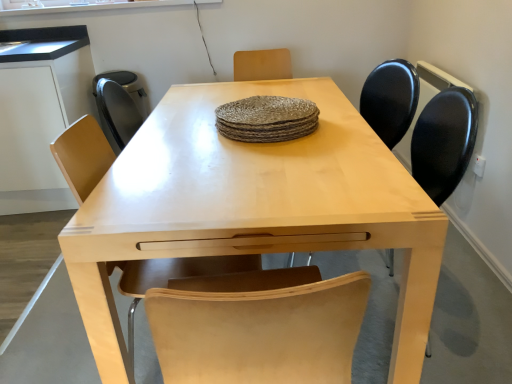
Where is `free space in front of rustic woven placemat at center`? The width and height of the screenshot is (512, 384). free space in front of rustic woven placemat at center is located at coordinates (282, 165).